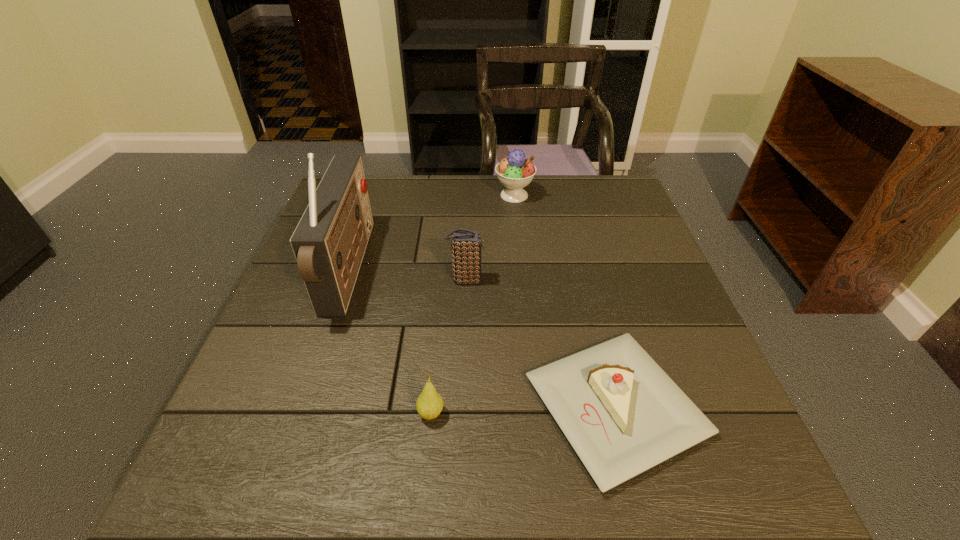
This screenshot has height=540, width=960. I want to click on vacant position located on the back of the shortest object, so click(x=593, y=321).

Locate an element on the screen. Image resolution: width=960 pixels, height=540 pixels. object located at the far edge is located at coordinates (515, 172).

Identify the location of object present at the near edge. Image resolution: width=960 pixels, height=540 pixels. coord(622,414).

Locate an element on the screen. The height and width of the screenshot is (540, 960). object that is at the left edge is located at coordinates (329, 242).

Identify the location of object at the right edge. (622, 414).

In order to click on object positioned at the near right corner in this screenshot , I will do `click(622, 414)`.

The image size is (960, 540). In the image, there is a desktop. Identify the location of vacant area at the far edge. (405, 178).

The height and width of the screenshot is (540, 960). In the image, there is a desktop. In order to click on vacant space at the near edge in this screenshot , I will do `click(347, 504)`.

Locate an element on the screen. This screenshot has width=960, height=540. free space at the left edge of the desktop is located at coordinates (238, 388).

The height and width of the screenshot is (540, 960). I want to click on vacant area at the right edge, so click(633, 256).